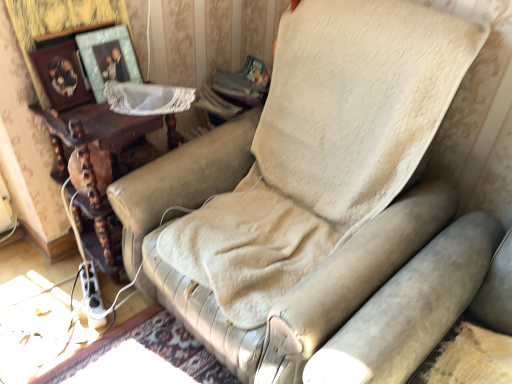
In order to click on free location in front of metallic silver picture frame at upper left, which appears as the second picture frame when viewed from the left in this screenshot , I will do `click(90, 119)`.